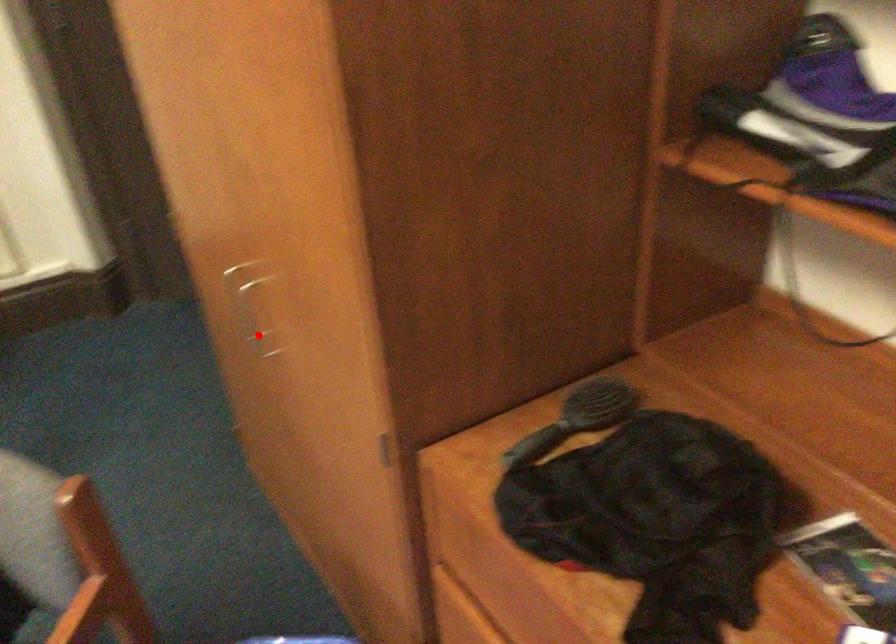
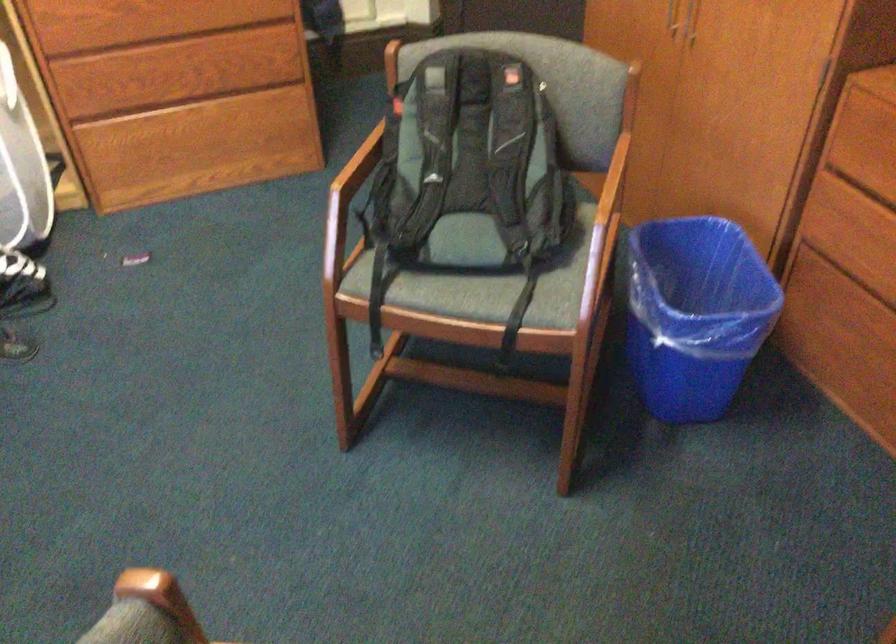
Where in the second image is the point corresponding to the highlighted location from the first image?

(691, 21)